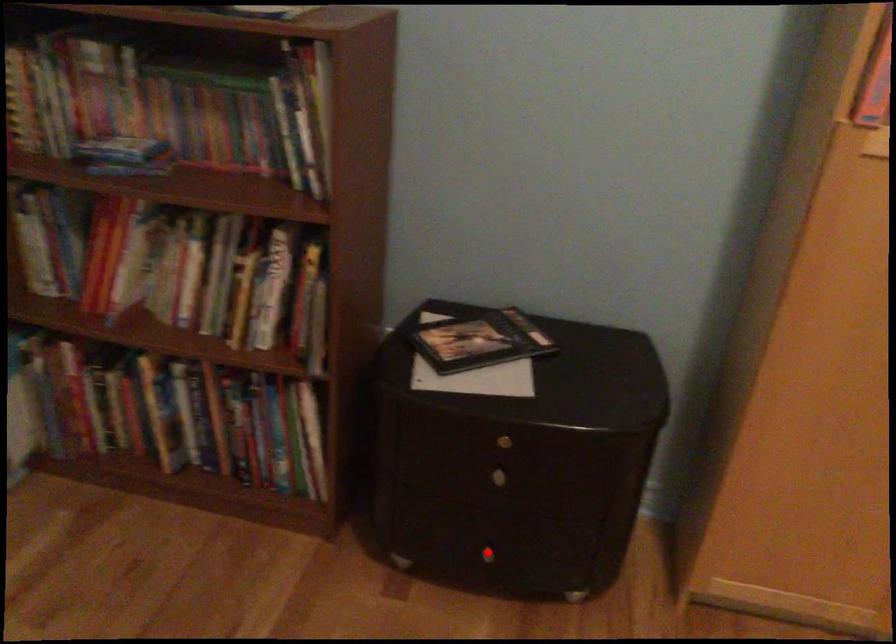
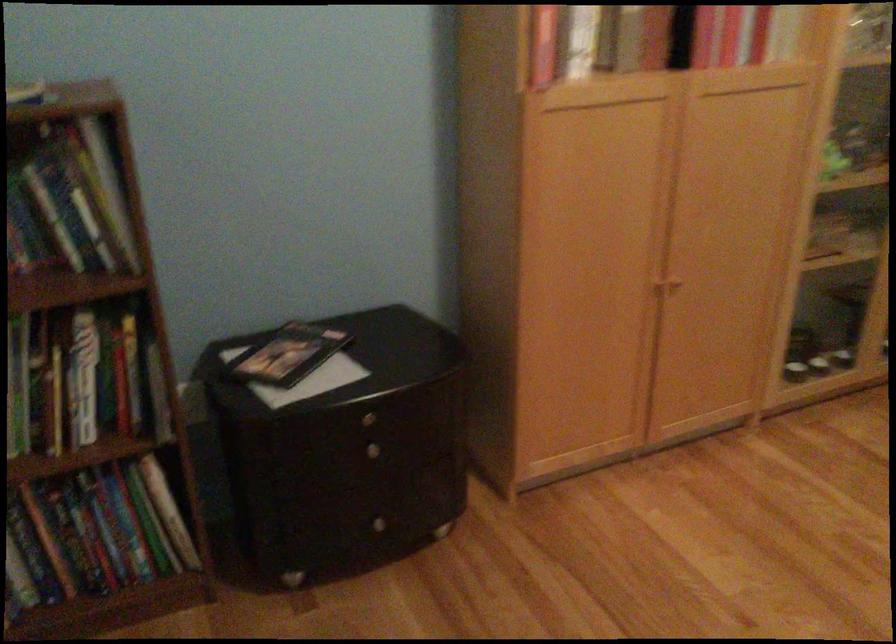
Where in the second image is the point corresponding to the highlighted location from the first image?

(380, 524)